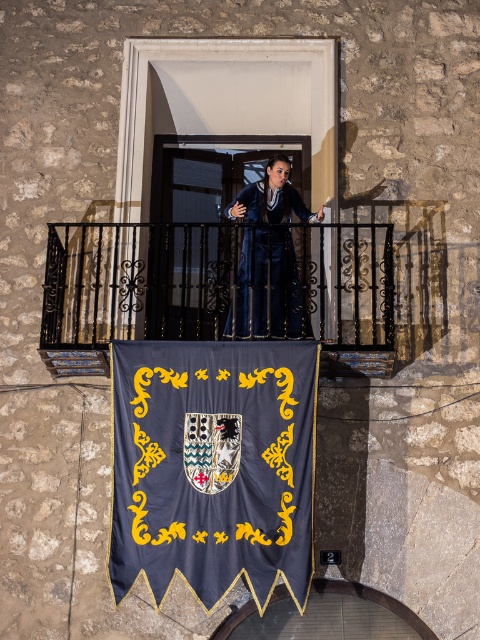
Can you confirm if dark blue fabric banner at center is positioned below velvet blue business suit at center?

Yes, dark blue fabric banner at center is below velvet blue business suit at center.

Is dark blue fabric banner at center positioned before velvet blue business suit at center?

Yes, it is in front of velvet blue business suit at center.

I want to click on dark blue fabric banner at center, so click(213, 467).

Which is more to the right, black wrought iron balustrade at center or velvet blue business suit at center?

velvet blue business suit at center is more to the right.

The image size is (480, 640). Describe the element at coordinates (218, 289) in the screenshot. I see `black wrought iron balustrade at center` at that location.

Locate an element on the screen. black wrought iron balustrade at center is located at coordinates (218, 289).

Where is `black wrought iron balustrade at center`? This screenshot has height=640, width=480. black wrought iron balustrade at center is located at coordinates (218, 289).

Who is positioned more to the left, dark blue fabric banner at center or black wrought iron balustrade at center?

From the viewer's perspective, black wrought iron balustrade at center appears more on the left side.

Does dark blue fabric banner at center appear on the left side of black wrought iron balustrade at center?

Incorrect, dark blue fabric banner at center is not on the left side of black wrought iron balustrade at center.

Which is behind, point (241, 413) or point (308, 291)?

The point (308, 291) is behind.

Where is `dark blue fabric banner at center`? The image size is (480, 640). dark blue fabric banner at center is located at coordinates (213, 467).